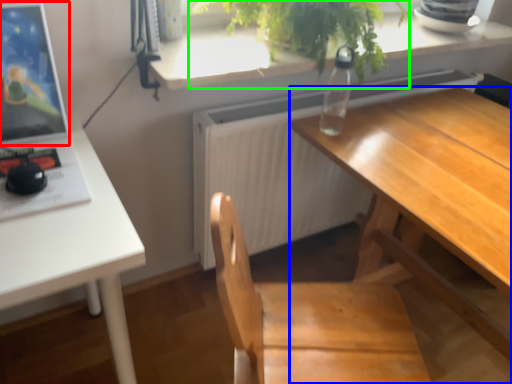
Question: Which object is positioned closest to computer monitor (highlighted by a red box)? Select from desk (highlighted by a blue box) and houseplant (highlighted by a green box).

Choices:
 (A) desk
 (B) houseplant

Answer: (B)